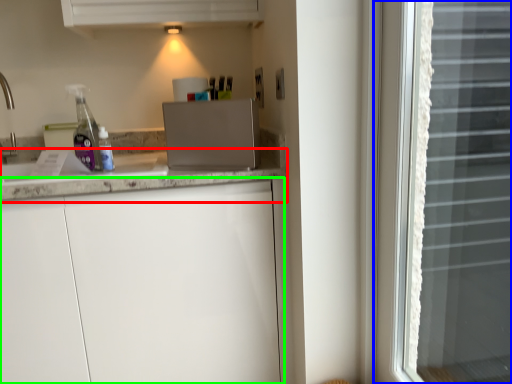
Question: Considering the real-world distances, which object is farthest from countertop (highlighted by a red box)? window (highlighted by a blue box) or cabinetry (highlighted by a green box)?

Choices:
 (A) window
 (B) cabinetry

Answer: (A)